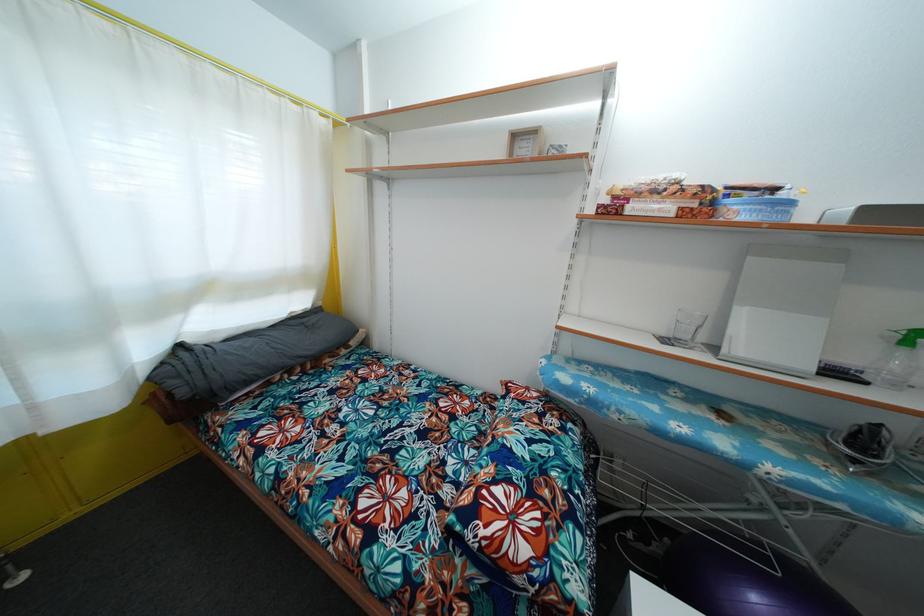
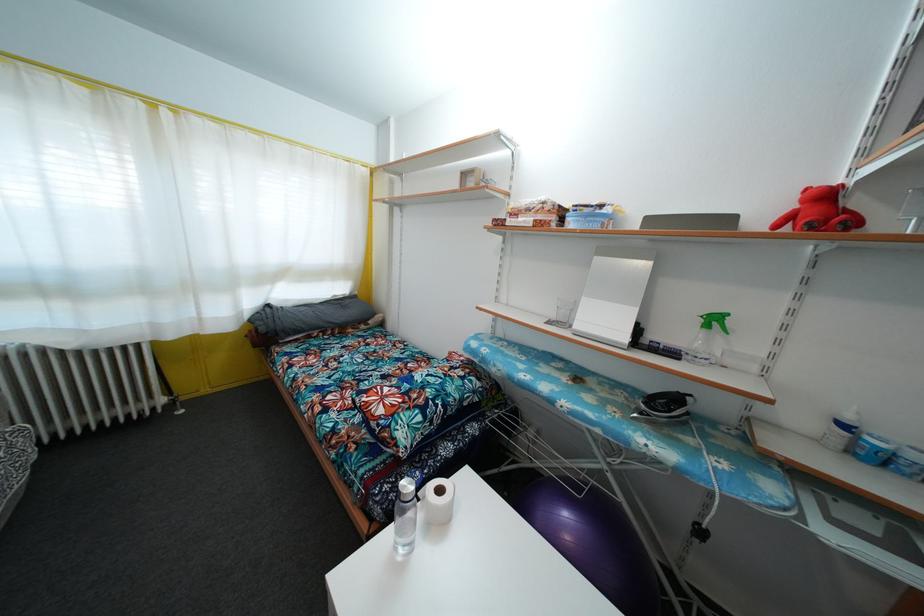
Find the pixel in the second image that matches (323,310) in the first image.

(359, 300)